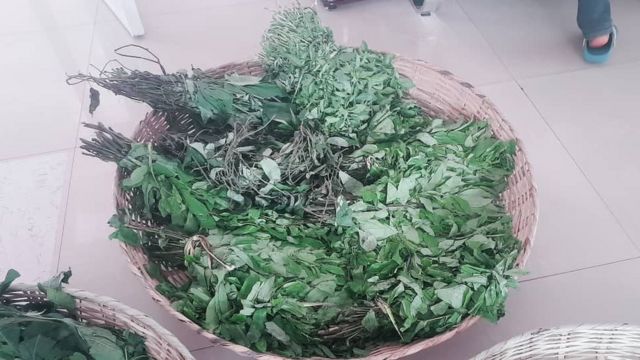
Find the location of a particular element. The height and width of the screenshot is (360, 640). metal leg likely to a chair or table is located at coordinates (429, 4).